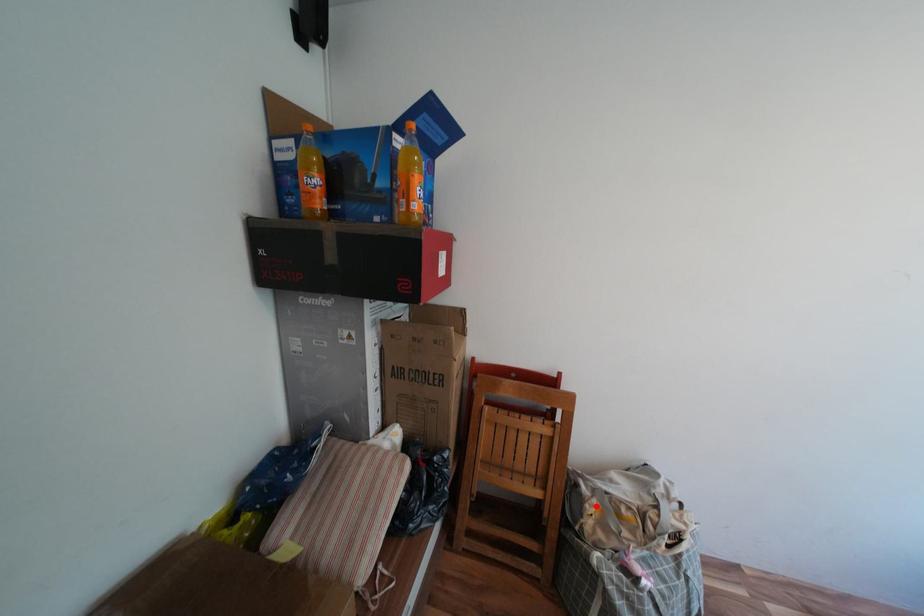
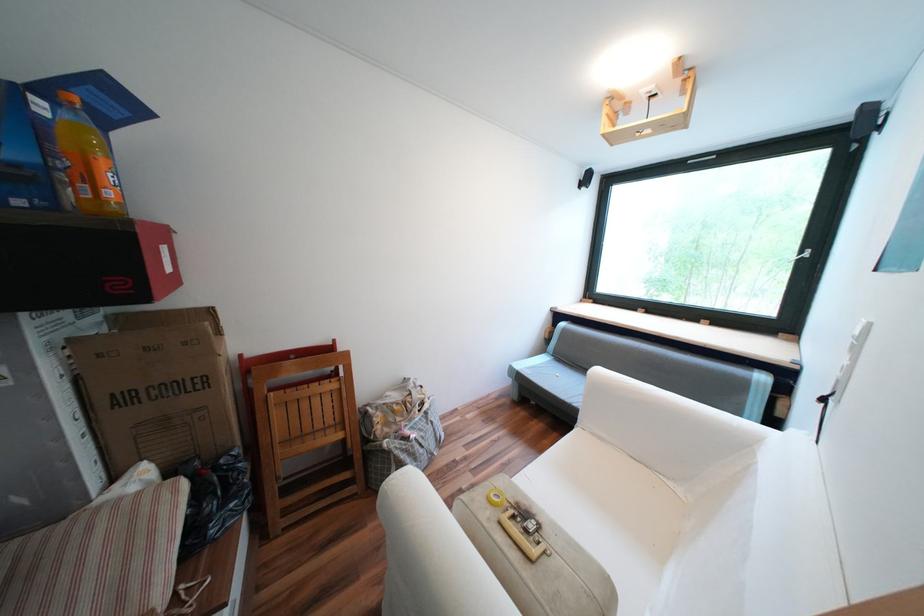
Question: I am providing you with two images of the same scene from different viewpoints. A red point is shown in image1. For the corresponding object point in image2, is it positioned nearer or farther from the camera?

Choices:
 (A) Nearer
 (B) Farther

Answer: (B)